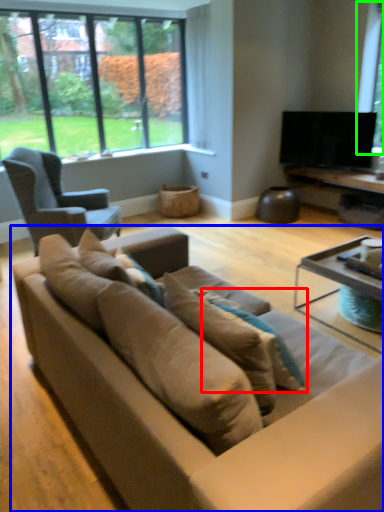
Question: Which is farther away from pillow (highlighted by a red box)? studio couch (highlighted by a blue box) or window screen (highlighted by a green box)?

Choices:
 (A) studio couch
 (B) window screen

Answer: (B)